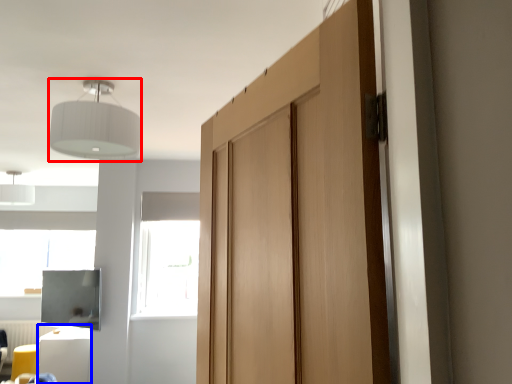
Question: Which object appears farthest to the camera in this image, light fixture (highlighted by a red box) or furniture (highlighted by a blue box)?

Choices:
 (A) light fixture
 (B) furniture

Answer: (B)